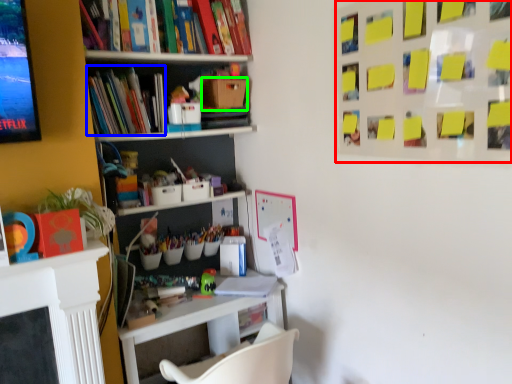
Question: Which object is positioned farthest from bulletin board (highlighted by a red box)? Select from book (highlighted by a blue box) and cardboard box (highlighted by a green box).

Choices:
 (A) book
 (B) cardboard box

Answer: (A)